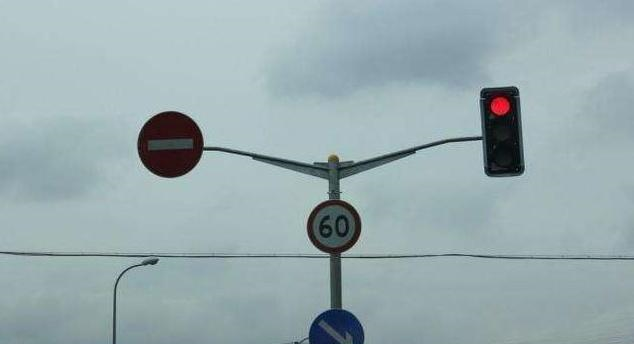
The width and height of the screenshot is (634, 344). Find the location of `light`. light is located at coordinates (146, 260).